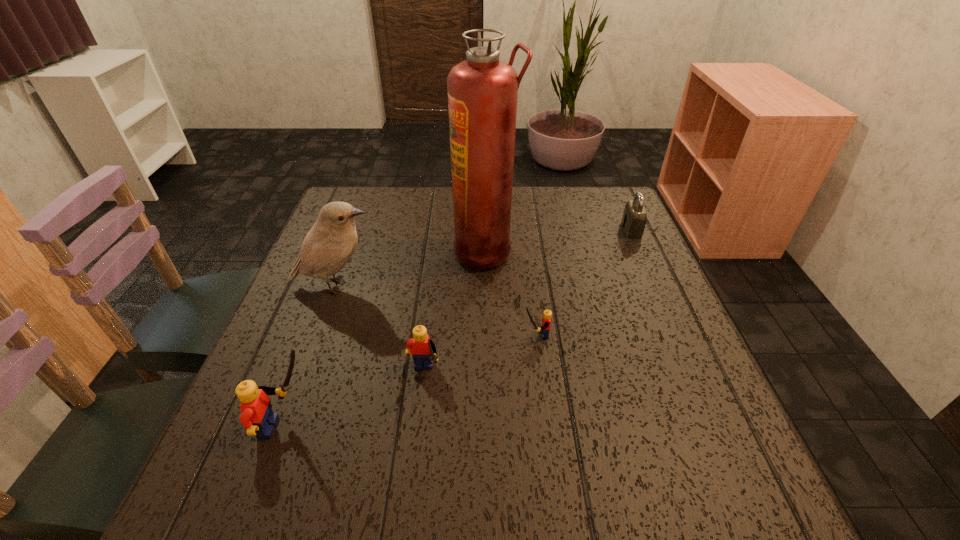
Locate an element on the screen. This screenshot has height=540, width=960. vacant area situated 0.090m on the front-facing side of the leftmost Lego is located at coordinates (366, 427).

This screenshot has width=960, height=540. Identify the location of vacant area located 0.050m on the front-facing side of the second farthest Lego. (418, 418).

The width and height of the screenshot is (960, 540). I want to click on vacant point located on the front-facing side of the farthest Lego, so click(420, 335).

Find the location of a particular element. This screenshot has height=540, width=960. free location located on the front-facing side of the farthest Lego is located at coordinates (424, 335).

At what (x,y) coordinates should I click in order to perform the action: click on free space located on the front-facing side of the farthest Lego. Please return your answer as a coordinate pair (x, y). Looking at the image, I should click on (452, 335).

Where is `vacant region located 0.270m at the front of the padlock near the keyhole`? vacant region located 0.270m at the front of the padlock near the keyhole is located at coordinates (526, 230).

Where is `free space located 0.090m at the front of the padlock near the keyhole`? The height and width of the screenshot is (540, 960). free space located 0.090m at the front of the padlock near the keyhole is located at coordinates (590, 230).

Find the location of a particular element. vacant space located at the front of the padlock near the keyhole is located at coordinates (587, 230).

Image resolution: width=960 pixels, height=540 pixels. Identify the location of free spot located 0.220m on the side of the fire extinguisher with the label. (371, 251).

Where is `free spot located on the side of the fire extinguisher with the label`? free spot located on the side of the fire extinguisher with the label is located at coordinates (329, 251).